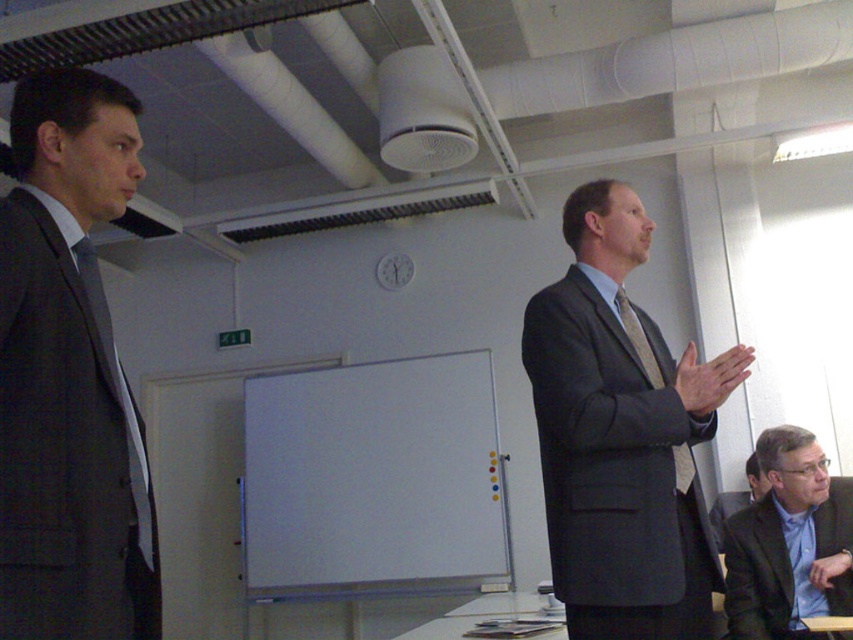
The height and width of the screenshot is (640, 853). What do you see at coordinates (621, 435) in the screenshot?
I see `matte gray suit at center` at bounding box center [621, 435].

Locate an element on the screen. The image size is (853, 640). matte gray suit at center is located at coordinates (621, 435).

At what (x,y) coordinates should I click in order to perform the action: click on matte gray suit at center. Please return your answer as a coordinate pair (x, y). The image size is (853, 640). Looking at the image, I should click on click(621, 435).

Can you confirm if blue shirt at center is wider than dark gray suit at right?

No.

Who is positioned more to the left, blue shirt at center or dark gray suit at right?

blue shirt at center is more to the left.

The width and height of the screenshot is (853, 640). In order to click on blue shirt at center in this screenshot , I will do `click(788, 544)`.

Can you confirm if matte gray suit at left is wider than matte gray suit at center?

No.

Who is more forward, [68,160] or [560,577]?

Point [68,160] is in front.

This screenshot has width=853, height=640. In order to click on matte gray suit at left in this screenshot , I will do `click(68, 376)`.